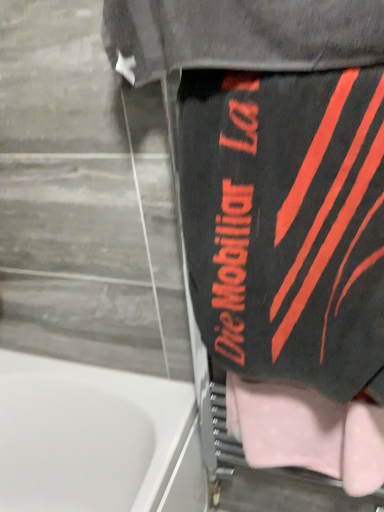
Question: From the image's perspective, relative to pink fabric towel at lower right, is black matte towel at right above or below?

Choices:
 (A) below
 (B) above

Answer: (B)

Question: Relative to pink fabric towel at lower right, is black matte towel at right in front or behind?

Choices:
 (A) behind
 (B) front

Answer: (B)

Question: Does point (187, 145) appear closer or farther from the camera than point (360, 402)?

Choices:
 (A) farther
 (B) closer

Answer: (B)

Question: Choose the correct answer: Is pink fabric towel at lower right inside black matte towel at right or outside it?

Choices:
 (A) outside
 (B) inside

Answer: (A)

Question: Does point (369, 483) appear closer or farther from the camera than point (256, 280)?

Choices:
 (A) closer
 (B) farther

Answer: (B)

Question: Considering the relative positions of pink fabric towel at lower right and black matte towel at right in the image provided, is pink fabric towel at lower right to the left or to the right of black matte towel at right?

Choices:
 (A) right
 (B) left

Answer: (A)

Question: Considering the positions of pink fabric towel at lower right and black matte towel at right in the image, is pink fabric towel at lower right bigger or smaller than black matte towel at right?

Choices:
 (A) small
 (B) big

Answer: (A)